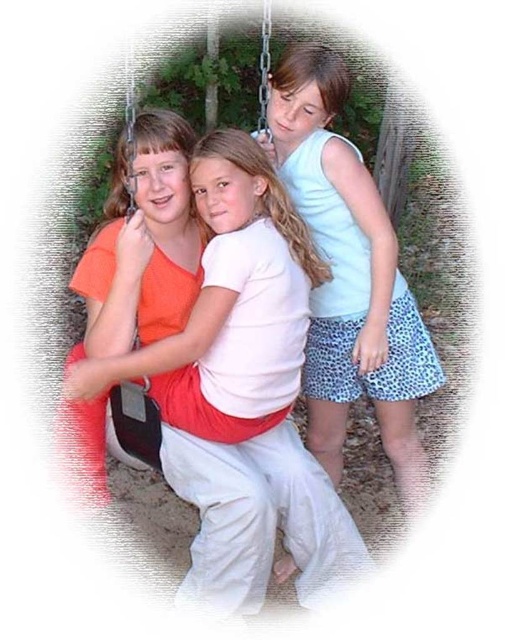
Question: In this image, where is white cotton shirt at center located relative to matte red swing at center?

Choices:
 (A) right
 (B) left

Answer: (A)

Question: Which object is closer to the camera taking this photo?

Choices:
 (A) white cotton shirt at center
 (B) light blue fabric shorts at center

Answer: (A)

Question: From the image, what is the correct spatial relationship of light blue fabric shorts at center in relation to matte red swing at center?

Choices:
 (A) left
 (B) right

Answer: (B)

Question: Does white cotton shirt at center appear on the left side of light blue fabric shorts at center?

Choices:
 (A) yes
 (B) no

Answer: (A)

Question: Which point is farther to the camera?

Choices:
 (A) light blue fabric shorts at center
 (B) white cotton shirt at center

Answer: (A)

Question: Which point appears closest to the camera in this image?

Choices:
 (A) (227, 326)
 (B) (414, 371)
 (C) (118, 458)

Answer: (A)